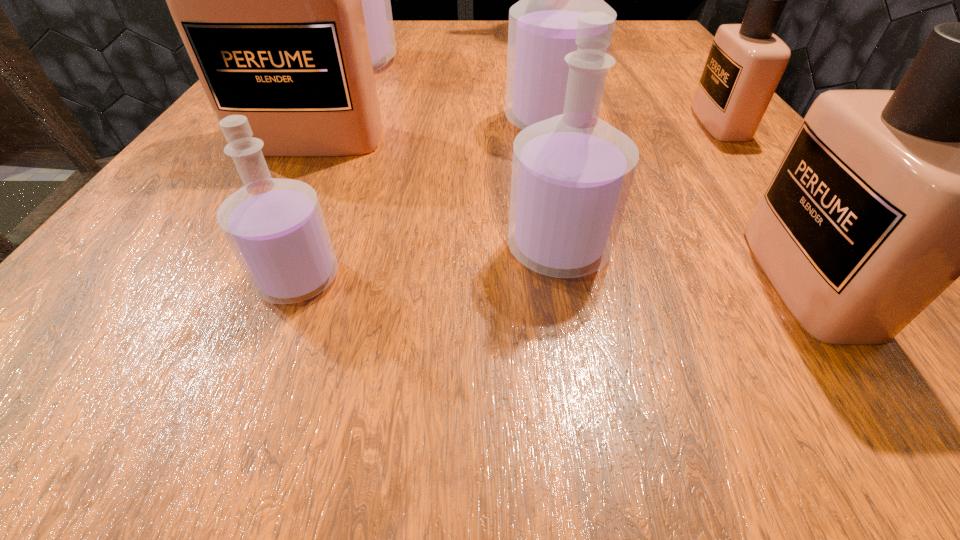
Where is `free area in between the second smallest purple perfume and the smallest purple perfume`? The width and height of the screenshot is (960, 540). free area in between the second smallest purple perfume and the smallest purple perfume is located at coordinates (428, 264).

The width and height of the screenshot is (960, 540). Find the location of `free space between the tallest perfume and the smallest purple perfume`. free space between the tallest perfume and the smallest purple perfume is located at coordinates [x=326, y=170].

Identify the location of object that is the second closest to the third biggest purple perfume. Image resolution: width=960 pixels, height=540 pixels. (542, 29).

Where is `object that is the third closest to the smallest beige perfume`? This screenshot has width=960, height=540. object that is the third closest to the smallest beige perfume is located at coordinates (603, 0).

Locate which perfume ranks second in proximity to the second smallest purple perfume. Please provide its 2D coordinates. Your answer should be formatted as a tuple, i.e. [(x, y)], where the tuple contains the x and y coordinates of a point satisfying the conditions above.

[(542, 29)]

Identify the location of perfume that is the closest to the second biggest purple perfume. The height and width of the screenshot is (540, 960). (746, 61).

Locate which purple perfume ranks in proximity to the smallest purple perfume. Please provide its 2D coordinates. Your answer should be formatted as a tuple, i.e. [(x, y)], where the tuple contains the x and y coordinates of a point satisfying the conditions above.

[(571, 174)]

Locate which purple perfume ranks in proximity to the second tallest object. Please provide its 2D coordinates. Your answer should be formatted as a tuple, i.e. [(x, y)], where the tuple contains the x and y coordinates of a point satisfying the conditions above.

[(542, 29)]

At what (x,y) coordinates should I click in order to perform the action: click on the closest beige perfume to the leftmost beige perfume. Please return your answer as a coordinate pair (x, y). Looking at the image, I should click on (884, 198).

Identify which beige perfume is the closest to the farthest purple perfume. Please provide its 2D coordinates. Your answer should be formatted as a tuple, i.e. [(x, y)], where the tuple contains the x and y coordinates of a point satisfying the conditions above.

[(267, 0)]